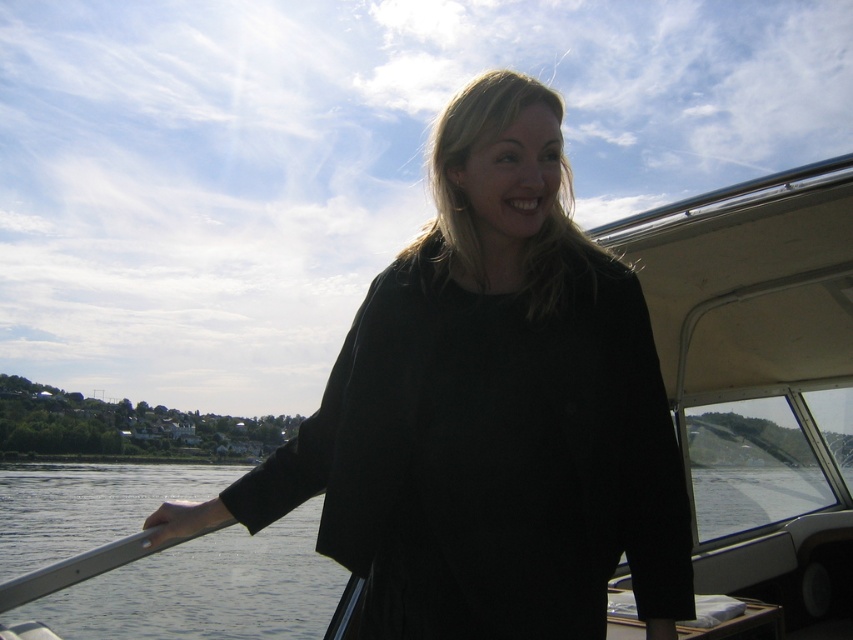
Question: Which of the following is the farthest from the observer?

Choices:
 (A) transparent water at lower left
 (B) black matte dress at center

Answer: (A)

Question: Which point appears closest to the camera in this image?

Choices:
 (A) (608, 301)
 (B) (252, 602)

Answer: (A)

Question: Is black matte dress at center smaller than transparent water at lower left?

Choices:
 (A) no
 (B) yes

Answer: (A)

Question: Does black matte dress at center come in front of transparent water at lower left?

Choices:
 (A) no
 (B) yes

Answer: (B)

Question: Is black matte dress at center further to camera compared to transparent water at lower left?

Choices:
 (A) yes
 (B) no

Answer: (B)